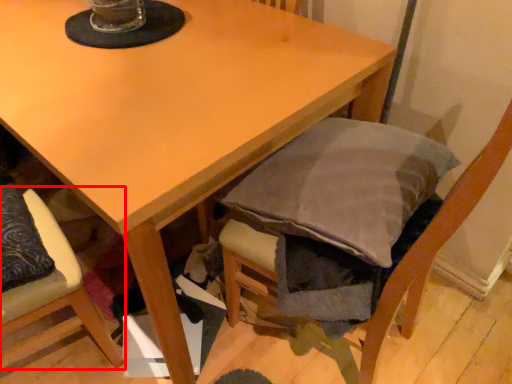
Question: Observing the image, what is the correct spatial positioning of chair (annotated by the red box) in reference to chair?

Choices:
 (A) right
 (B) left

Answer: (B)